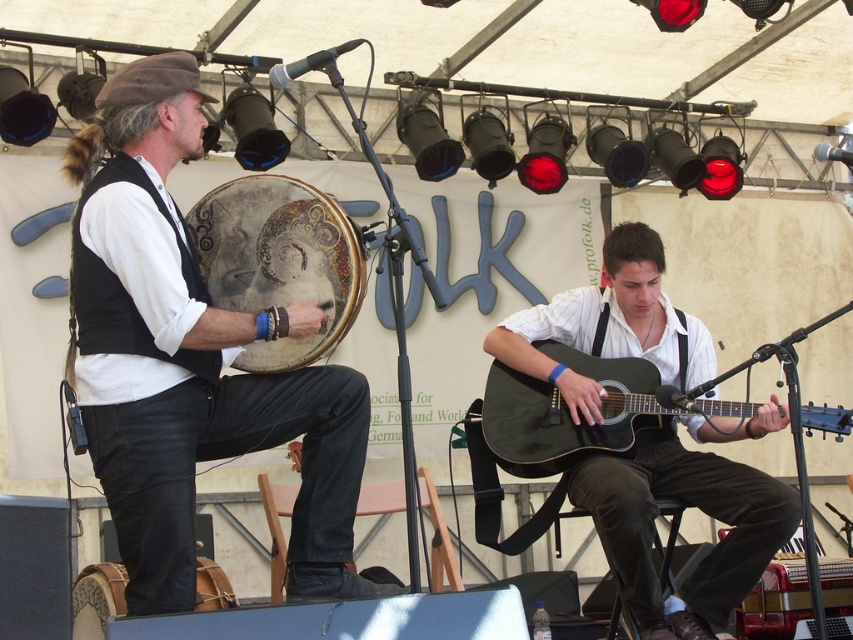
Question: Considering the real-world distances, which object is farthest from the matte black drum at left?

Choices:
 (A) matte black acoustic guitar at lower right
 (B) distressed leather drum at center
 (C) matte black guitar at center

Answer: (A)

Question: Can you confirm if matte black drum at left is positioned below matte black guitar at center?

Choices:
 (A) no
 (B) yes

Answer: (A)

Question: Among these objects, which one is nearest to the camera?

Choices:
 (A) distressed leather drum at center
 (B) leather drum at lower left
 (C) matte black acoustic guitar at lower right

Answer: (A)

Question: Is matte black drum at left to the left of matte black guitar at center from the viewer's perspective?

Choices:
 (A) yes
 (B) no

Answer: (A)

Question: Which point is closer to the camera?

Choices:
 (A) matte black drum at left
 (B) matte black guitar at center
 (C) leather drum at lower left
 (D) matte black acoustic guitar at lower right

Answer: (A)

Question: Does matte black drum at left appear on the left side of leather drum at lower left?

Choices:
 (A) no
 (B) yes

Answer: (A)